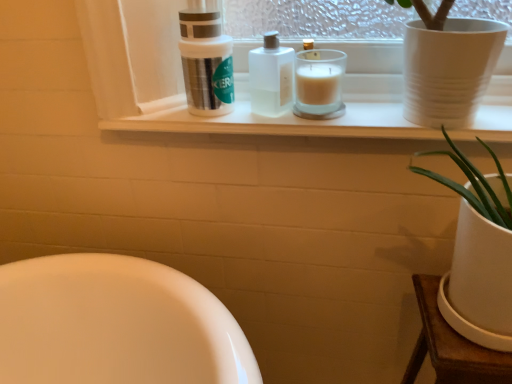
What are the coordinates of `vacant space to the right of silver metallic container at upper center` in the screenshot? It's located at (286, 120).